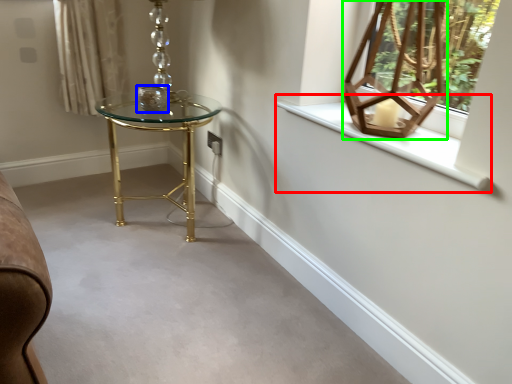
Question: Estimate the real-world distances between objects in this image. Which object is farther from window sill (highlighted by a red box), candle holder (highlighted by a blue box) or table lamp (highlighted by a green box)?

Choices:
 (A) candle holder
 (B) table lamp

Answer: (A)